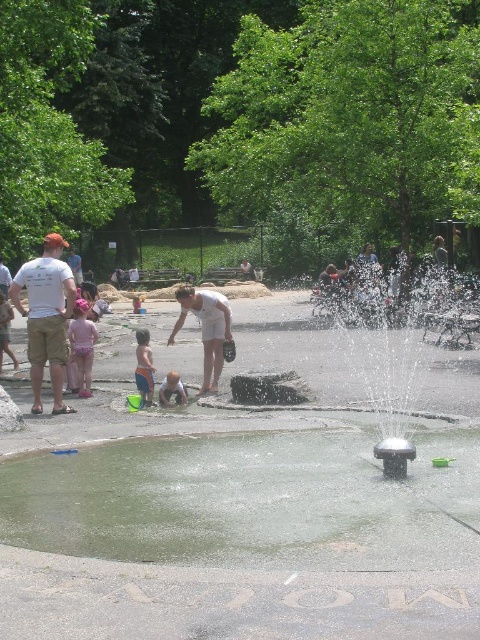
You are standing at the camera position looking at the scene. Which of the two points, point (343, 451) or point (145, 330), is nearer to you?

Point (343, 451) is closer to the camera than point (145, 330), so it is nearer to you.

You are a photographer standing at the edge of the park. You want to capture a photo that includes both the metallic gray fountain at center and the light blue shorts at lower left. Which object should you position closer to the center of your camera frame to ensure both fit in the shot?

Since the metallic gray fountain at center is wider than the light blue shorts at lower left, you should position the metallic gray fountain at center closer to the center of your camera frame to ensure both fit in the shot.